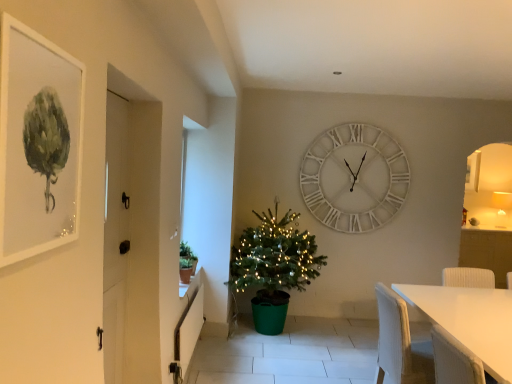
Question: Can you see green matte plant at left touching white wooden door at left?

Choices:
 (A) yes
 (B) no

Answer: (B)

Question: Is green matte plant at left outside of white wooden door at left?

Choices:
 (A) yes
 (B) no

Answer: (A)

Question: Is green matte plant at left further to camera compared to white wooden door at left?

Choices:
 (A) yes
 (B) no

Answer: (A)

Question: From the image's perspective, is green matte plant at left located beneath white wooden door at left?

Choices:
 (A) yes
 (B) no

Answer: (A)

Question: From a real-world perspective, is green matte plant at left physically above white wooden door at left?

Choices:
 (A) no
 (B) yes

Answer: (A)

Question: Does point (332, 200) appear closer or farther from the camera than point (254, 274)?

Choices:
 (A) farther
 (B) closer

Answer: (A)

Question: Based on their sizes in the image, would you say white wooden clock at upper center is bigger or smaller than green plastic christmas tree at center?

Choices:
 (A) small
 (B) big

Answer: (A)

Question: Which is correct: white wooden clock at upper center is inside green plastic christmas tree at center, or outside of it?

Choices:
 (A) inside
 (B) outside

Answer: (B)

Question: Is white wooden clock at upper center taller or shorter than green plastic christmas tree at center?

Choices:
 (A) tall
 (B) short

Answer: (B)

Question: From the image's perspective, is white matte table at lower right above or below matte white picture frame at upper left?

Choices:
 (A) below
 (B) above

Answer: (A)

Question: Considering the relative positions of white matte table at lower right and matte white picture frame at upper left in the image provided, is white matte table at lower right to the left or to the right of matte white picture frame at upper left?

Choices:
 (A) right
 (B) left

Answer: (A)

Question: From a real-world perspective, is white matte table at lower right positioned above or below matte white picture frame at upper left?

Choices:
 (A) above
 (B) below

Answer: (B)

Question: Relative to matte white picture frame at upper left, is white matte table at lower right in front or behind?

Choices:
 (A) front
 (B) behind

Answer: (B)

Question: In the image, is white wooden clock at upper center positioned in front of or behind white wooden door at left?

Choices:
 (A) behind
 (B) front

Answer: (A)

Question: Is white wooden clock at upper center bigger or smaller than white wooden door at left?

Choices:
 (A) small
 (B) big

Answer: (B)